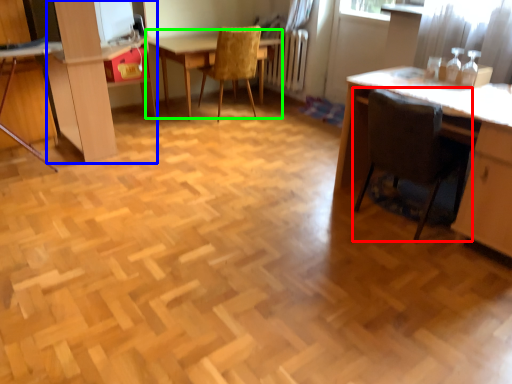
Question: Which object is the closest to the chair (highlighted by a red box)? Choose among these: dresser (highlighted by a blue box) or table (highlighted by a green box).

Choices:
 (A) dresser
 (B) table

Answer: (A)